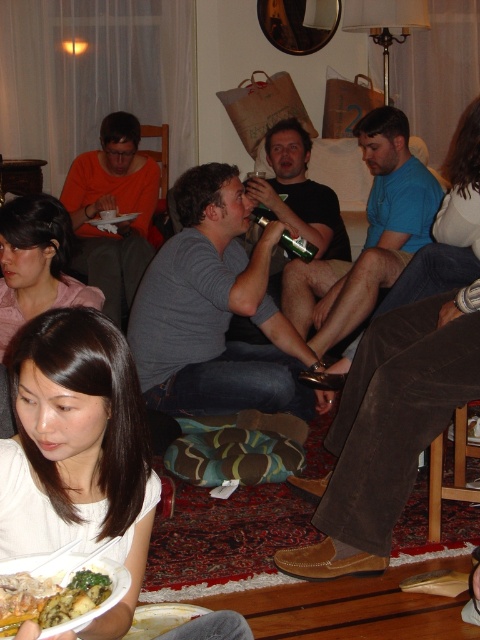
You are at a party and want to grab a drink from the green glass bottle at center. There are green leafy vegetables at lower left in the way. Can you reach the bottle without moving the vegetables?

The green leafy vegetables at lower left are to the left of the green glass bottle at center, so you can reach the bottle by moving around to the right side of the vegetables.